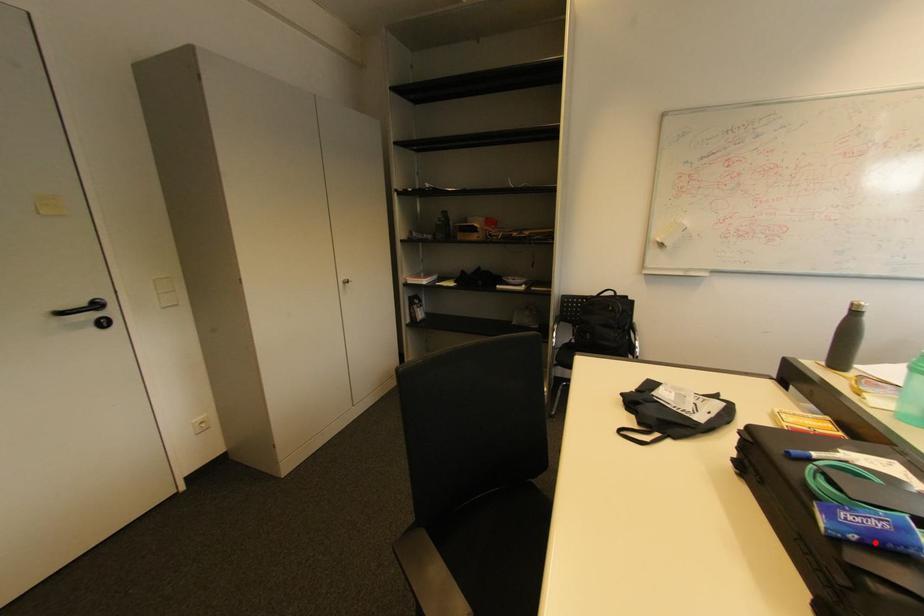
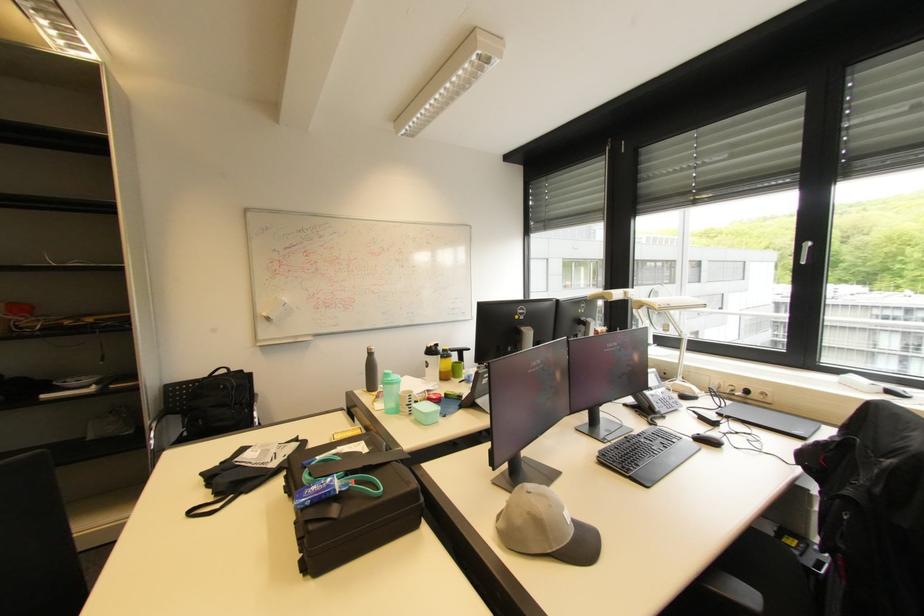
The point at the highlighted location is marked in the first image. Where is the corresponding point in the second image?

(321, 501)